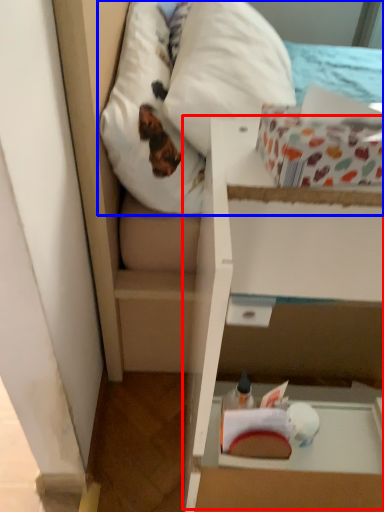
Question: Which of the following is the farthest to the observer, cardboard box (highlighted by a red box) or mattress (highlighted by a blue box)?

Choices:
 (A) cardboard box
 (B) mattress

Answer: (B)